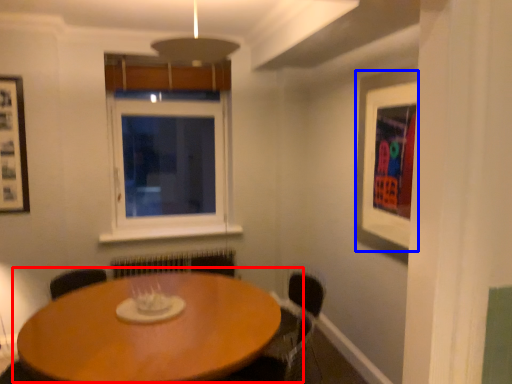
Question: Among these objects, which one is nearest to the camera, table (highlighted by a red box) or picture frame (highlighted by a blue box)?

Choices:
 (A) table
 (B) picture frame

Answer: (A)